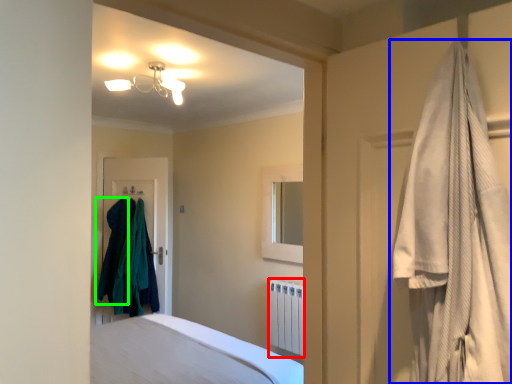
Question: Which object is the farthest from radiator (highlighted by a red box)? Choose among these: curtain (highlighted by a blue box) or clothing (highlighted by a green box).

Choices:
 (A) curtain
 (B) clothing

Answer: (A)